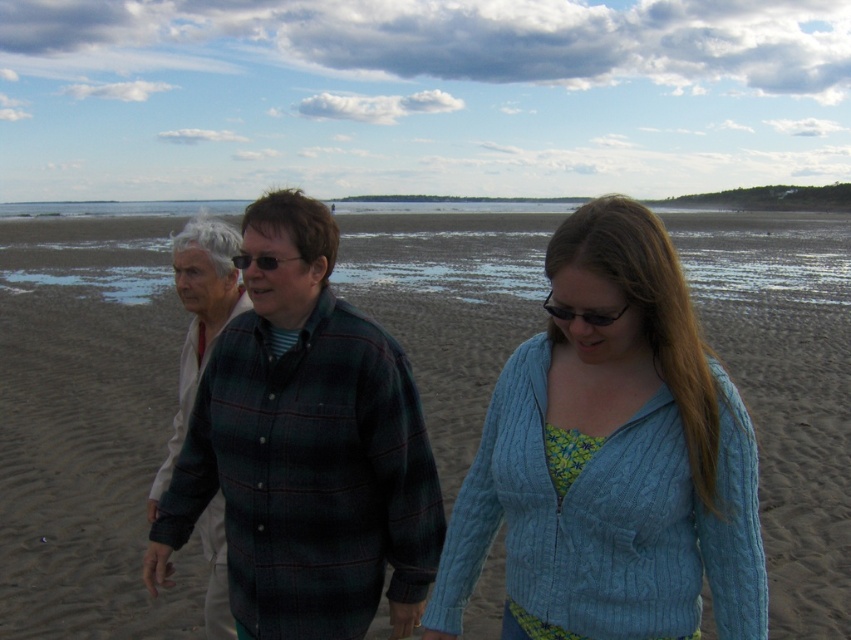
You are a photographer trying to capture a photo of the brown sandy beach at center and the green plaid shirt at center. Which object should you focus on first if you want to ensure both are in focus without adjusting the camera settings?

The brown sandy beach at center has a greater height compared to green plaid shirt at center, so focusing on the brown sandy beach at center first will ensure both are in focus since it is farther away.

You are a beachgoer who wants to place both the black plastic glasses at center and the black plastic sunglasses at center on a narrow shelf. Which item should you place first to ensure both fit side by side?

The black plastic sunglasses at center should be placed first since they are narrower than the black plastic glasses at center, allowing both to fit side by side on the narrow shelf.